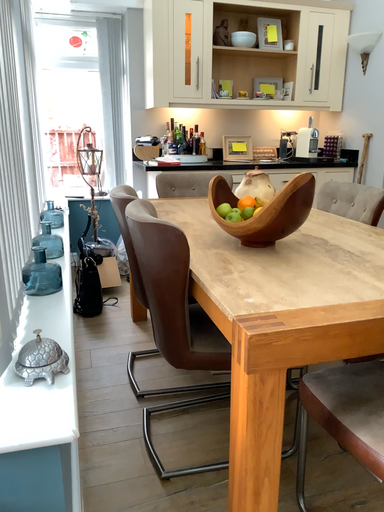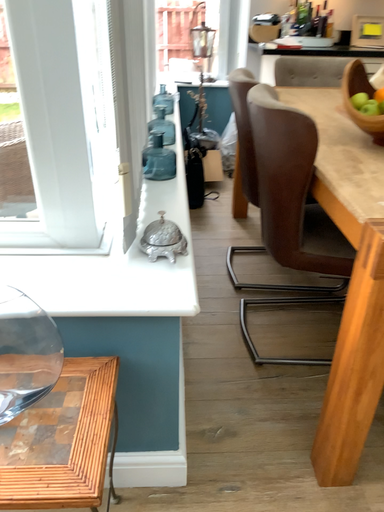
Question: Which way did the camera rotate in the video?

Choices:
 (A) rotated downward
 (B) rotated upward

Answer: (A)